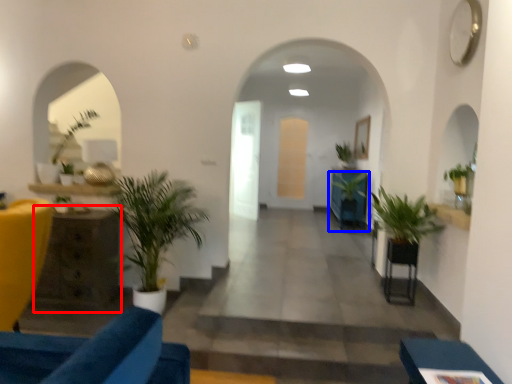
Question: Among these objects, which one is farthest to the camera, table (highlighted by a red box) or houseplant (highlighted by a blue box)?

Choices:
 (A) table
 (B) houseplant

Answer: (B)